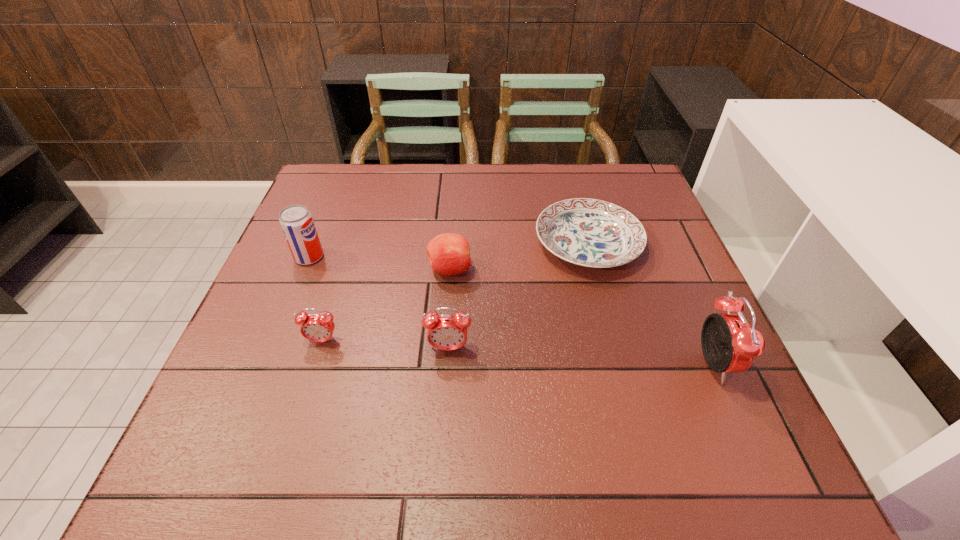
I want to click on unoccupied position between the apple and the second shortest alarm clock, so click(449, 309).

Where is `vacant point located between the soda and the apple`? The image size is (960, 540). vacant point located between the soda and the apple is located at coordinates (379, 264).

Identify the location of vacant space that's between the leftmost object and the rightmost alarm clock. The image size is (960, 540). (511, 310).

Locate which object ranks fifth in proximity to the leftmost object. Please provide its 2D coordinates. Your answer should be formatted as a tuple, i.e. [(x, y)], where the tuple contains the x and y coordinates of a point satisfying the conditions above.

[(729, 344)]

Find the location of a particular element. Image resolution: width=960 pixels, height=540 pixels. object that is the closest to the plate is located at coordinates (449, 254).

Select which alarm clock is the second closest to the rightmost alarm clock. Please provide its 2D coordinates. Your answer should be formatted as a tuple, i.e. [(x, y)], where the tuple contains the x and y coordinates of a point satisfying the conditions above.

[(315, 327)]

Identify which alarm clock is the second closest to the second shortest alarm clock. Please provide its 2D coordinates. Your answer should be formatted as a tuple, i.e. [(x, y)], where the tuple contains the x and y coordinates of a point satisfying the conditions above.

[(729, 344)]